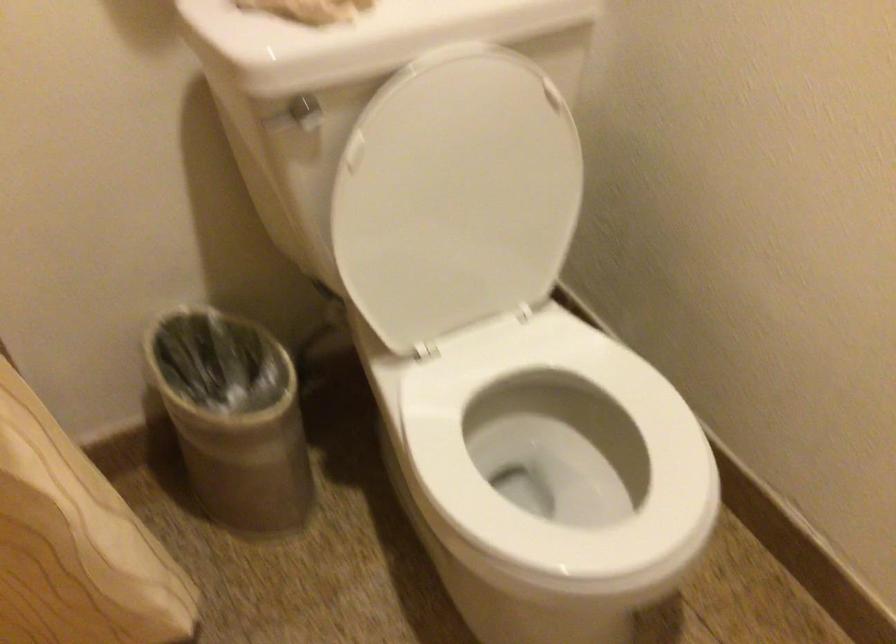
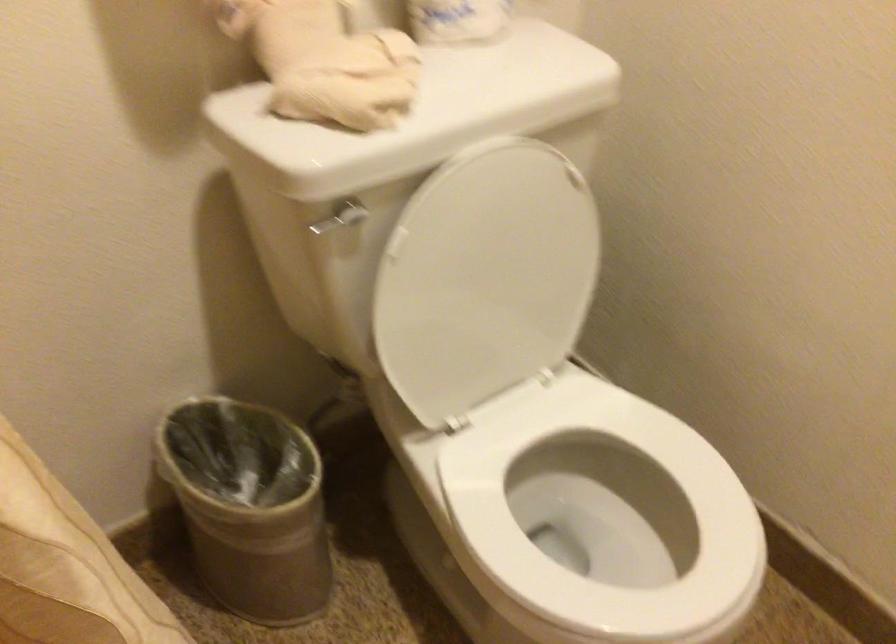
Question: Which direction would the cameraman need to move to produce the second image? Reply with the corresponding letter.

Choices:
 (A) Left
 (B) Right
 (C) Forward
 (D) Backward

Answer: (A)